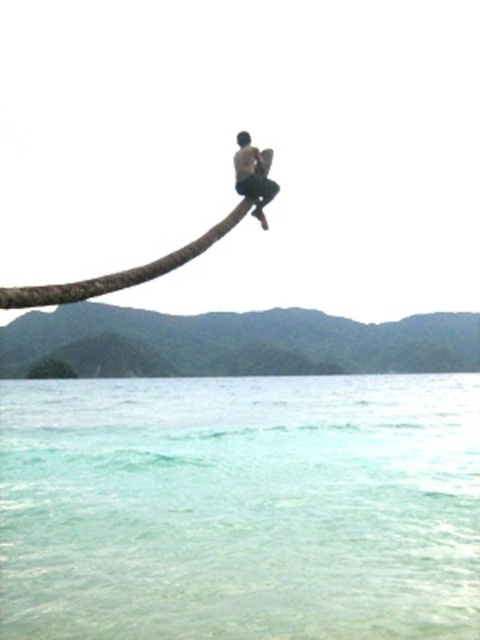
Is point (383, 525) positioned behind point (61, 284)?

Yes.

Can you confirm if clear water at lower center is wider than brown rough tree branch at upper center?

Yes.

Is point (372, 484) more distant than point (6, 291)?

That is True.

The width and height of the screenshot is (480, 640). Identify the location of clear water at lower center. (240, 508).

Which is below, brown rough tree branch at upper center or dark skin human at center?

brown rough tree branch at upper center is below.

Is brown rough tree branch at upper center bigger than dark skin human at center?

Indeed, brown rough tree branch at upper center has a larger size compared to dark skin human at center.

Is point (192, 253) positioned after point (238, 180)?

No.

What are the coordinates of `brown rough tree branch at upper center` in the screenshot? It's located at (120, 272).

Can you confirm if clear water at lower center is wider than dark skin human at center?

Yes, clear water at lower center is wider than dark skin human at center.

Which is behind, point (148, 472) or point (248, 188)?

The point (148, 472) is behind.

What do you see at coordinates (240, 508) in the screenshot?
I see `clear water at lower center` at bounding box center [240, 508].

I want to click on clear water at lower center, so click(240, 508).